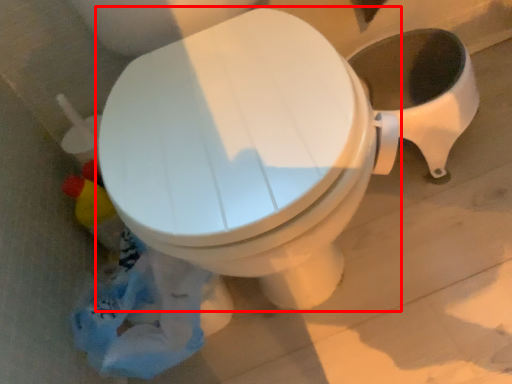
Question: From the image's perspective, considering the relative positions of toilet (annotated by the red box) and garbage in the image provided, where is toilet (annotated by the red box) located with respect to the staircase?

Choices:
 (A) below
 (B) above

Answer: (B)